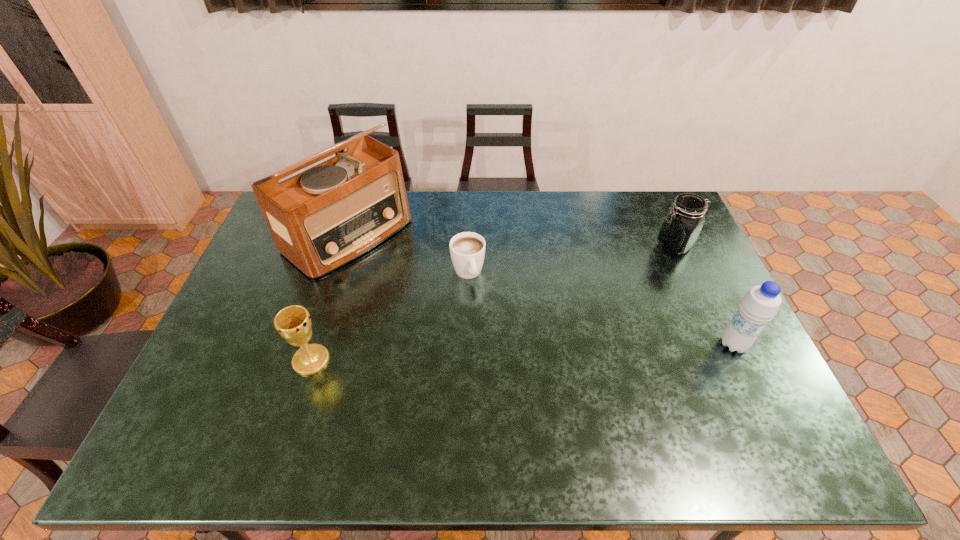
At what (x,y) coordinates should I click in order to perform the action: click on free space between the tallest object and the third object from left to right. Please return your answer as a coordinate pair (x, y). Looking at the image, I should click on (408, 254).

At what (x,y) coordinates should I click in order to perform the action: click on unoccupied area between the shortest object and the jar. Please return your answer as a coordinate pair (x, y). Image resolution: width=960 pixels, height=540 pixels. Looking at the image, I should click on (x=571, y=259).

Where is `vacant area that lies between the chalice and the jar`? Image resolution: width=960 pixels, height=540 pixels. vacant area that lies between the chalice and the jar is located at coordinates (492, 302).

The height and width of the screenshot is (540, 960). Find the location of `empty space between the jar and the chalice`. empty space between the jar and the chalice is located at coordinates (492, 302).

In order to click on free point between the chalice and the cappuccino in this screenshot , I will do (390, 316).

Where is `empty space between the jar and the chalice`? empty space between the jar and the chalice is located at coordinates (492, 302).

Locate an element on the screen. empty location between the chalice and the water bottle is located at coordinates (522, 352).

Identify which object is located as the third nearest to the tallest object. Please provide its 2D coordinates. Your answer should be formatted as a tuple, i.e. [(x, y)], where the tuple contains the x and y coordinates of a point satisfying the conditions above.

[(680, 229)]

Choose which object is the nearest neighbor to the tallest object. Please provide its 2D coordinates. Your answer should be formatted as a tuple, i.e. [(x, y)], where the tuple contains the x and y coordinates of a point satisfying the conditions above.

[(467, 249)]

Locate an element on the screen. Image resolution: width=960 pixels, height=540 pixels. free space that satisfies the following two spatial constraints: 1. on the front side of the tallest object; 2. on the right side of the chalice is located at coordinates (308, 360).